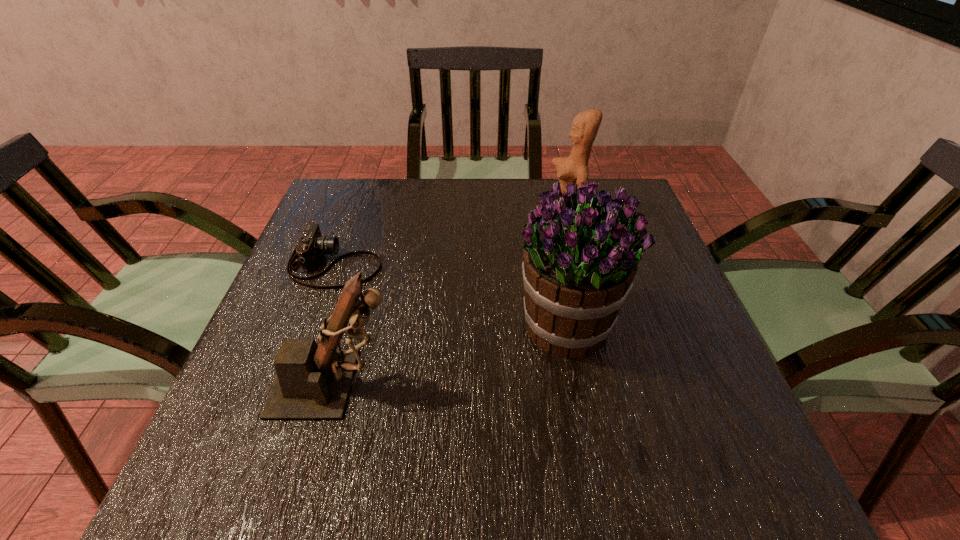
Locate an element on the screen. The width and height of the screenshot is (960, 540). vacant space at the right edge of the desktop is located at coordinates (706, 375).

Identify the location of blank space at the near left corner of the desktop. (230, 498).

The image size is (960, 540). I want to click on vacant space at the near right corner of the desktop, so click(699, 478).

I want to click on empty space between the right figurine and the shortest object, so click(x=451, y=240).

Locate an element on the screen. free space between the bouquet and the shortest object is located at coordinates (450, 294).

This screenshot has width=960, height=540. In order to click on free space between the right figurine and the shortest object in this screenshot , I will do `click(451, 240)`.

Where is `empty location between the shortest object and the right figurine`? Image resolution: width=960 pixels, height=540 pixels. empty location between the shortest object and the right figurine is located at coordinates (451, 240).

Find the location of `vacant space in between the left figurine and the bouquet`. vacant space in between the left figurine and the bouquet is located at coordinates (451, 355).

Identify the location of free spot between the bouquet and the nearer figurine. The height and width of the screenshot is (540, 960). (451, 355).

Find the location of a particular element. The image size is (960, 540). vacant point located between the left figurine and the bouquet is located at coordinates (451, 355).